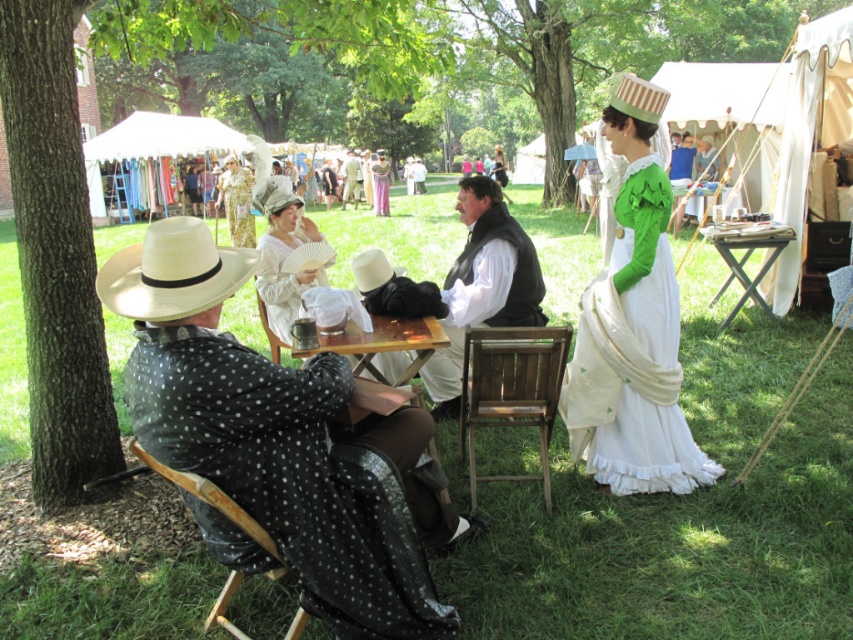
You are an observer at the historical reenactment. You notice two items of clothing on the man in the foreground. The black dotted fabric at left and the white cotton vest at center. Which clothing item is positioned lower on his body?

The black dotted fabric at left is positioned below the white cotton vest at center, so the black dotted fabric at left is lower on his body.

You are a costume designer observing the historical reenactment. You need to determine which fabric piece is larger between the black dotted fabric at left and the white cotton vest at center. Which one is bigger?

The black dotted fabric at left is bigger than the white cotton vest at center.

You are a festival attendee who wants to take a photo of the white cotton dress at center without including the brown rough bark tree at left in the background. Given that your camera has a 60cm wide lens, can you position yourself far enough away to ensure the tree is out of frame?

The brown rough bark tree at left is 2.65 meters from the white cotton dress at center. Since the camera lens is 60cm wide, you need to position yourself at least 2.65 meters plus 0.6 meters away from the dress to ensure the tree is out of frame. However, this calculation assumes a direct line of sight. Alternatively, moving sideways to the side opposite the tree might also help exclude it from the photo.